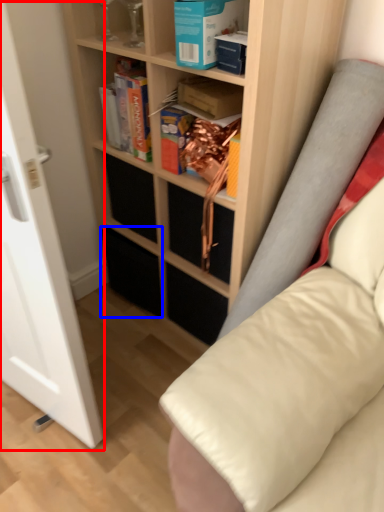
Question: Which of the following is the closest to the observer, glass door (highlighted by a red box) or drawer (highlighted by a blue box)?

Choices:
 (A) glass door
 (B) drawer

Answer: (A)